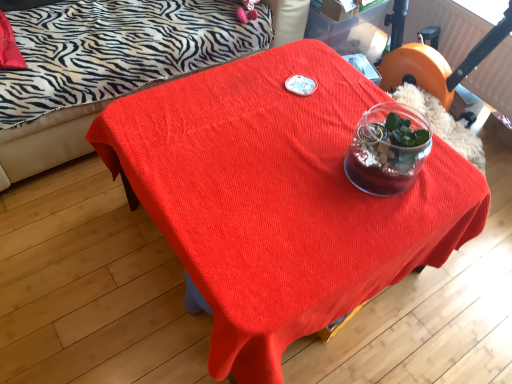
Question: In terms of height, does orange plastic swivel chair at upper right look taller or shorter compared to zebra-patterned fabric couch at upper left?

Choices:
 (A) tall
 (B) short

Answer: (B)

Question: Considering their positions, is orange plastic swivel chair at upper right located in front of or behind zebra-patterned fabric couch at upper left?

Choices:
 (A) behind
 (B) front

Answer: (A)

Question: Which object is positioned closest to the zebra-patterned fabric couch at upper left?

Choices:
 (A) orange plastic swivel chair at upper right
 (B) matte red table at center

Answer: (B)

Question: Which object is the farthest from the orange plastic swivel chair at upper right?

Choices:
 (A) zebra-patterned fabric couch at upper left
 (B) matte red table at center

Answer: (A)